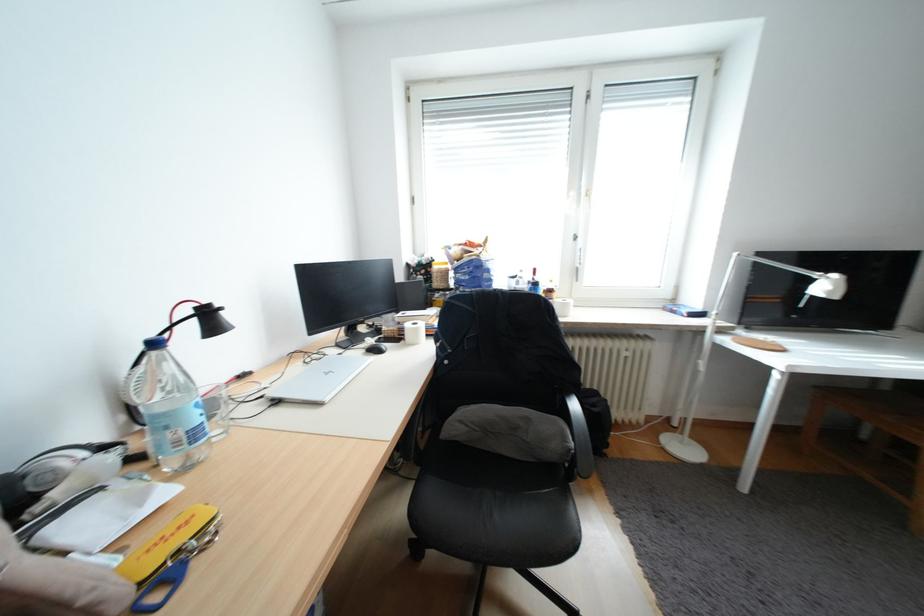
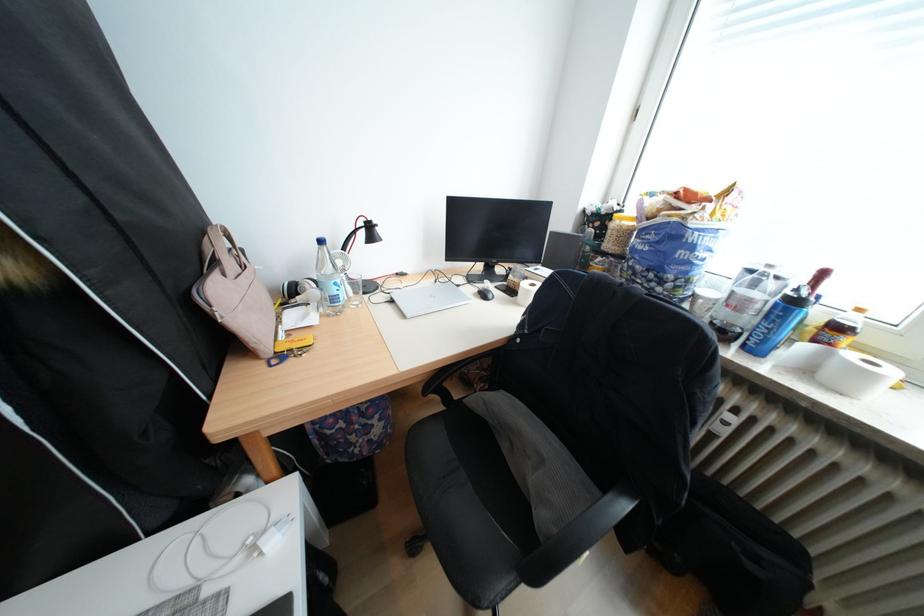
In the second image, find the point that corresponds to the point at 530,283 in the first image.

(767, 285)